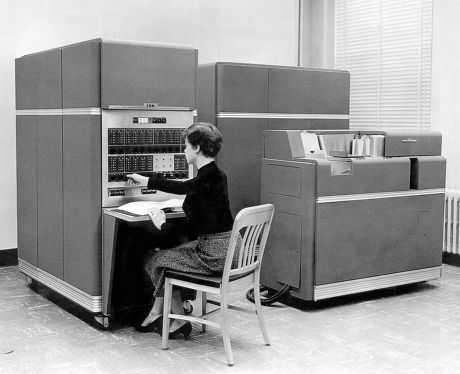
Find the location of a particular element. This screenshot has height=374, width=460. handle is located at coordinates (411, 139).